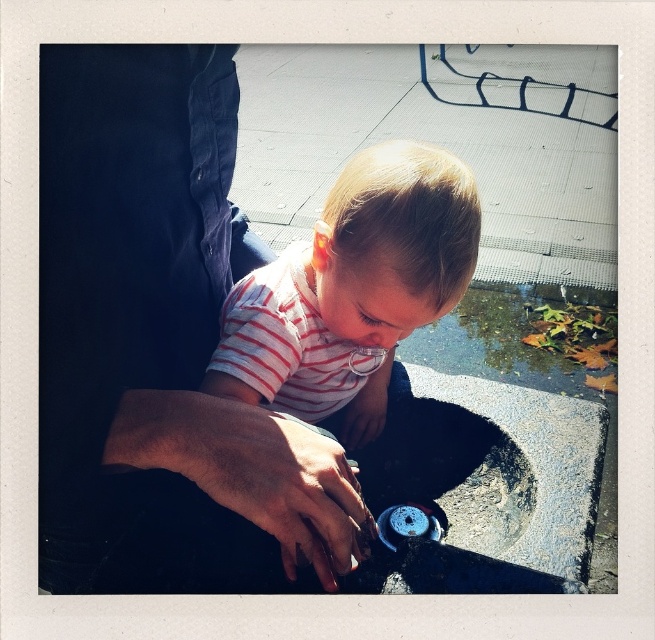
You are a photographer wanting to take a picture of the dark blue jeans at left. You have a camera that requires a minimum distance of 20 inches to focus properly. Can you take the photo from where you are standing?

The dark blue jeans at left and camera are 22.47 inches apart, which is more than the minimum required 20 inches. Therefore, you can take the photo from where you are standing.